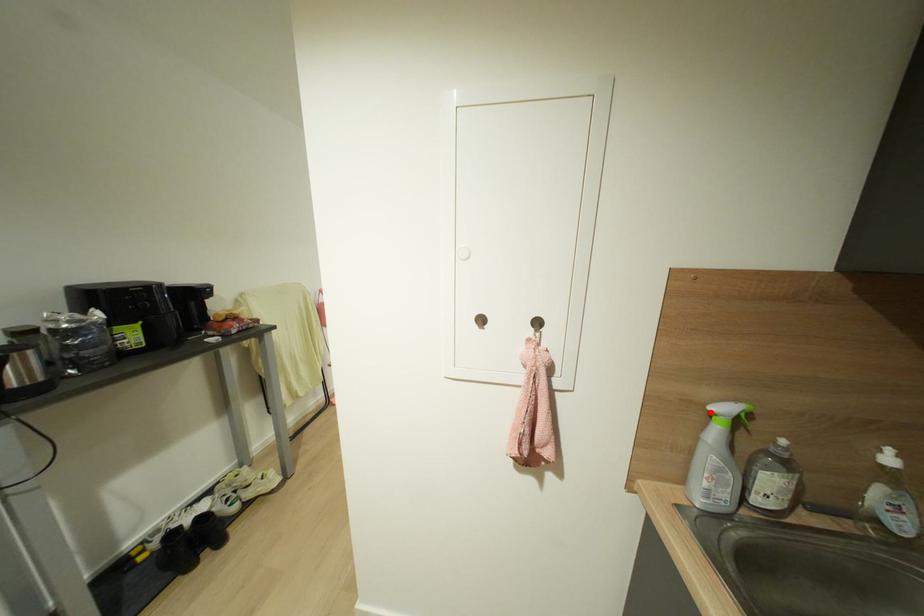
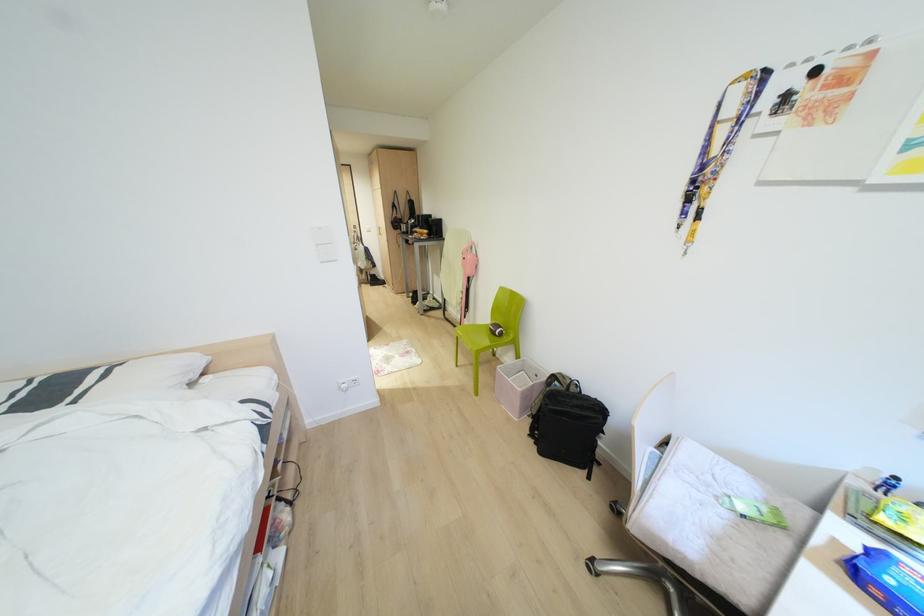
Question: I am providing you with two images of the same scene from different viewpoints. A red point is marked on the first image. Is the red point's position out of view in image 2?

Choices:
 (A) Yes
 (B) No

Answer: (A)